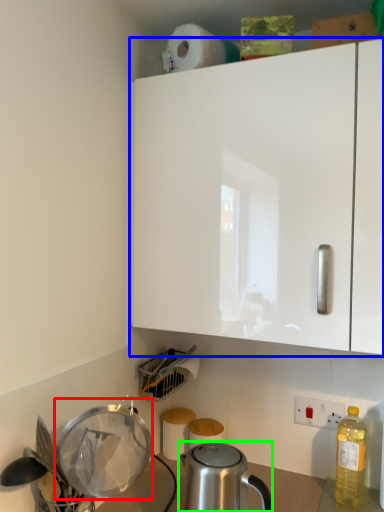
Question: Based on their relative distances, which object is farther from appliance (highlighted by a red box)? Choose from cabinetry (highlighted by a blue box) and kettle (highlighted by a green box).

Choices:
 (A) cabinetry
 (B) kettle

Answer: (A)